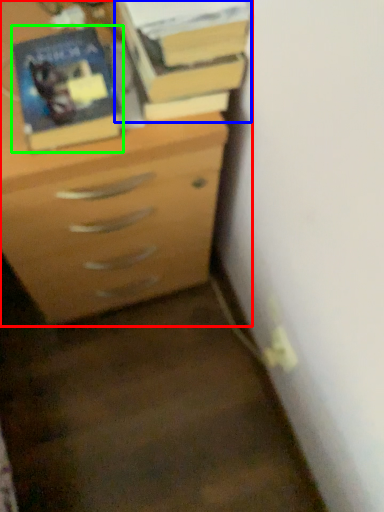
Question: Estimate the real-world distances between objects in this image. Which object is closer to chest of drawers (highlighted by a red box), book (highlighted by a blue box) or paperback book (highlighted by a green box)?

Choices:
 (A) book
 (B) paperback book

Answer: (B)